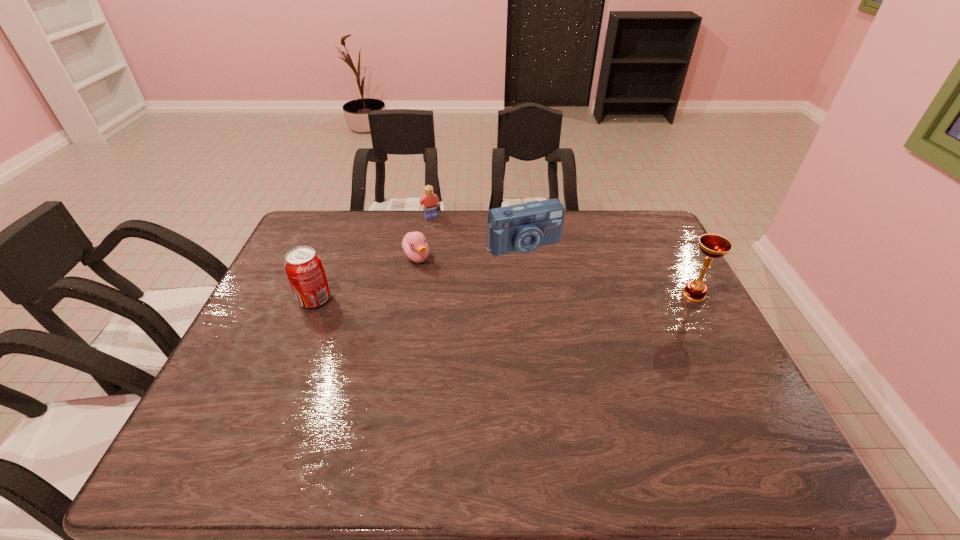
This screenshot has height=540, width=960. Identify the location of free space between the duckling and the chalice. (555, 276).

This screenshot has width=960, height=540. Find the location of `unoccupied position between the leftmost object and the farthest object`. unoccupied position between the leftmost object and the farthest object is located at coordinates (372, 258).

Find the location of `free space between the fourth object from left to right and the farthest object`. free space between the fourth object from left to right and the farthest object is located at coordinates (477, 231).

Where is `unoccupied position between the chalice and the Lego`? This screenshot has width=960, height=540. unoccupied position between the chalice and the Lego is located at coordinates (563, 255).

Choose which object is the nearest neighbor to the chalice. Please provide its 2D coordinates. Your answer should be formatted as a tuple, i.e. [(x, y)], where the tuple contains the x and y coordinates of a point satisfying the conditions above.

[(523, 228)]

The width and height of the screenshot is (960, 540). Identify the location of the second closest object to the soda. (430, 201).

You are a GUI agent. You are given a task and a screenshot of the screen. Output one action in this format:
    pyautogui.click(x=<x>, y=<y>)
    Task: Click on the vacant area that satisfies the following two spatial constraints: 1. on the back side of the second object from right to left; 2. on the right side of the leftmost object
    
    Given the screenshot: What is the action you would take?
    pyautogui.click(x=337, y=245)

This screenshot has width=960, height=540. In order to click on free spot that satisfies the following two spatial constraints: 1. on the back side of the shortest object; 2. on the left side of the soda in this screenshot , I will do `click(331, 258)`.

This screenshot has height=540, width=960. In order to click on vacant space that satisfies the following two spatial constraints: 1. on the back side of the leftmost object; 2. on the left side of the chalice in this screenshot , I will do `click(317, 295)`.

At what (x,y) coordinates should I click in order to perform the action: click on vacant space that satisfies the following two spatial constraints: 1. on the front side of the rightmost object; 2. on the right side of the farthest object. Please return your answer as a coordinate pair (x, y). Looking at the image, I should click on (420, 295).